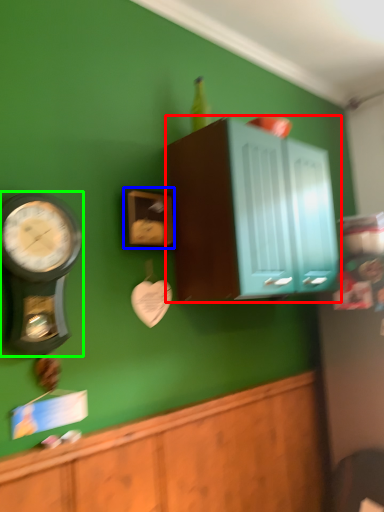
Question: Which object is positioned farthest from cabinetry (highlighted by a red box)? Select from clock (highlighted by a blue box) and wall clock (highlighted by a green box).

Choices:
 (A) clock
 (B) wall clock

Answer: (B)